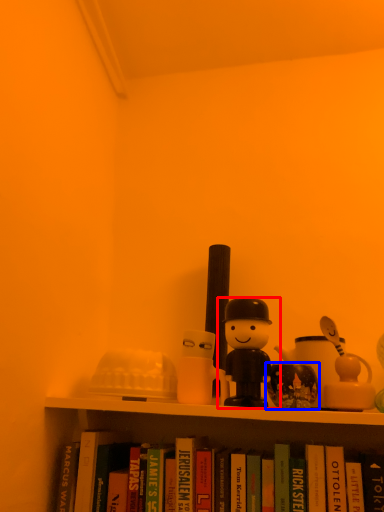
Question: Among these objects, which one is nearest to the camera, toy (highlighted by a red box) or toy (highlighted by a blue box)?

Choices:
 (A) toy
 (B) toy

Answer: (A)